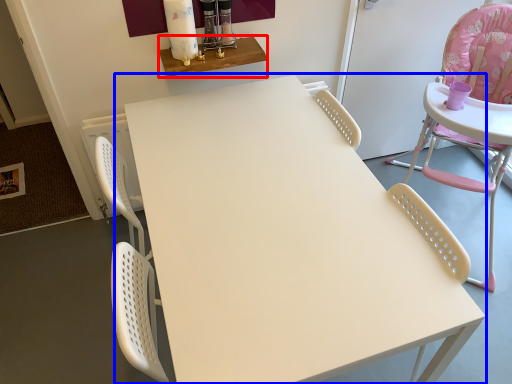
Question: Which object appears closest to the camera in this image, table (highlighted by a red box) or table (highlighted by a blue box)?

Choices:
 (A) table
 (B) table

Answer: (B)